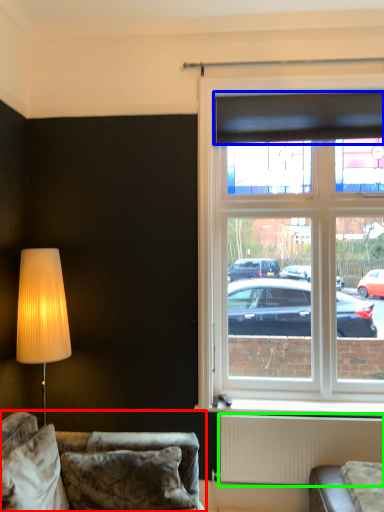
Question: Which object is the closest to the studio couch (highlighted by a red box)? Choose among these: curtain (highlighted by a blue box) or radiator (highlighted by a green box).

Choices:
 (A) curtain
 (B) radiator

Answer: (B)